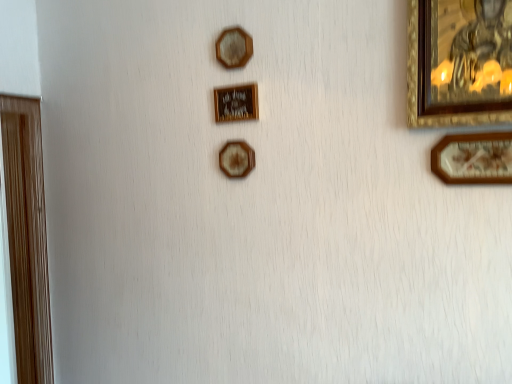
Question: From the image's perspective, does gold metallic picture frame at center, marked as the fourth picture frame in a front-to-back arrangement, appear lower than wooden hexagon at upper center, the 4th picture frame when ordered from back to front?

Choices:
 (A) yes
 (B) no

Answer: (A)

Question: From a real-world perspective, is gold metallic picture frame at center, marked as the fourth picture frame in a front-to-back arrangement, below wooden hexagon at upper center, the 3th picture frame when ordered from front to back?

Choices:
 (A) no
 (B) yes

Answer: (B)

Question: Can you confirm if gold metallic picture frame at center, acting as the third picture frame starting from the back, is positioned to the right of wooden hexagon at upper center, the 3th picture frame when ordered from front to back?

Choices:
 (A) yes
 (B) no

Answer: (A)

Question: From a real-world perspective, does gold metallic picture frame at center, the 4th picture frame from the left, stand above wooden hexagon at upper center, the 4th picture frame when ordered from back to front?

Choices:
 (A) no
 (B) yes

Answer: (A)

Question: Can you confirm if gold metallic picture frame at center, the 4th picture frame from the left, is thinner than wooden hexagon at upper center, positioned as the second picture frame in left-to-right order?

Choices:
 (A) yes
 (B) no

Answer: (A)

Question: From the image's perspective, is gold metallic picture frame at center, acting as the third picture frame starting from the back, located above wooden hexagon at upper center, the 3th picture frame when ordered from front to back?

Choices:
 (A) yes
 (B) no

Answer: (B)

Question: Does gold-framed painting at upper right, arranged as the fifth picture frame when viewed from the left, have a lesser height compared to wooden hexagon at center, the 3th picture frame positioned from the left?

Choices:
 (A) yes
 (B) no

Answer: (B)

Question: From the image's perspective, is gold-framed painting at upper right, arranged as the 2th picture frame when viewed from the right, on top of wooden hexagon at center, marked as the fifth picture frame in a front-to-back arrangement?

Choices:
 (A) yes
 (B) no

Answer: (A)

Question: Is gold-framed painting at upper right, arranged as the 2th picture frame when viewed from the right, next to wooden hexagon at center, the second picture frame positioned from the back, and touching it?

Choices:
 (A) yes
 (B) no

Answer: (B)

Question: Considering the relative positions of gold-framed painting at upper right, arranged as the 2th picture frame when viewed from the right, and wooden hexagon at center, the 3th picture frame positioned from the left, in the image provided, is gold-framed painting at upper right, arranged as the 2th picture frame when viewed from the right, behind wooden hexagon at center, the 3th picture frame positioned from the left,?

Choices:
 (A) yes
 (B) no

Answer: (B)

Question: From a real-world perspective, is gold-framed painting at upper right, arranged as the fifth picture frame when viewed from the left, physically above wooden hexagon at center, the second picture frame positioned from the back?

Choices:
 (A) yes
 (B) no

Answer: (A)

Question: Is the position of gold-framed painting at upper right, which ranks as the 5th picture frame in back-to-front order, less distant than that of wooden hexagon at center, marked as the fifth picture frame in a front-to-back arrangement?

Choices:
 (A) yes
 (B) no

Answer: (A)

Question: Can you confirm if wooden picture frame at right, the first picture frame in the front-to-back sequence, is positioned to the left of wooden door at left, the first picture frame in the back-to-front sequence?

Choices:
 (A) yes
 (B) no

Answer: (B)